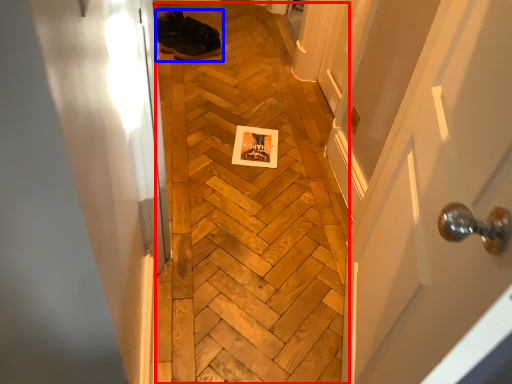
Question: Which point is closer to the camera, plywood (highlighted by a red box) or footwear (highlighted by a blue box)?

Choices:
 (A) plywood
 (B) footwear

Answer: (A)